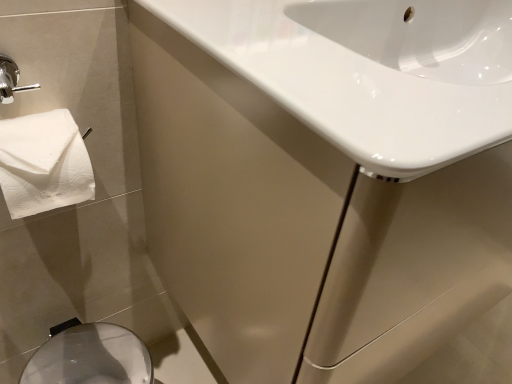
Question: From the image's perspective, is white glossy sink at upper right over white glossy sink at upper right?

Choices:
 (A) no
 (B) yes

Answer: (B)

Question: Is white glossy sink at upper right facing away from white glossy sink at upper right?

Choices:
 (A) yes
 (B) no

Answer: (A)

Question: Are white glossy sink at upper right and white glossy sink at upper right far apart?

Choices:
 (A) yes
 (B) no

Answer: (B)

Question: From a real-world perspective, is white glossy sink at upper right over white glossy sink at upper right?

Choices:
 (A) no
 (B) yes

Answer: (B)

Question: Considering the relative sizes of white glossy sink at upper right and white glossy sink at upper right in the image provided, is white glossy sink at upper right shorter than white glossy sink at upper right?

Choices:
 (A) yes
 (B) no

Answer: (A)

Question: Considering the positions of white glossy sink at upper right and white glossy sink at upper right in the image, is white glossy sink at upper right taller or shorter than white glossy sink at upper right?

Choices:
 (A) tall
 (B) short

Answer: (B)

Question: From the image's perspective, is white glossy sink at upper right located above or below white glossy sink at upper right?

Choices:
 (A) below
 (B) above

Answer: (B)

Question: In the image, is white glossy sink at upper right positioned in front of or behind white glossy sink at upper right?

Choices:
 (A) front
 (B) behind

Answer: (A)

Question: Is white glossy sink at upper right wider or thinner than white glossy sink at upper right?

Choices:
 (A) wide
 (B) thin

Answer: (B)

Question: Considering the positions of point (227, 301) and point (122, 342), is point (227, 301) closer or farther from the camera than point (122, 342)?

Choices:
 (A) farther
 (B) closer

Answer: (B)

Question: Is white glossy sink at upper right in front of or behind silver metallic bidet at lower left in the image?

Choices:
 (A) behind
 (B) front

Answer: (B)

Question: Do you think white glossy sink at upper right is within silver metallic bidet at lower left, or outside of it?

Choices:
 (A) outside
 (B) inside

Answer: (A)

Question: In the image, is white glossy sink at upper right on the left side or the right side of silver metallic bidet at lower left?

Choices:
 (A) left
 (B) right

Answer: (B)

Question: Considering the positions of silver metallic bidet at lower left and white glossy sink at upper right in the image, is silver metallic bidet at lower left taller or shorter than white glossy sink at upper right?

Choices:
 (A) short
 (B) tall

Answer: (A)

Question: Looking at their shapes, would you say silver metallic bidet at lower left is wider or thinner than white glossy sink at upper right?

Choices:
 (A) wide
 (B) thin

Answer: (B)